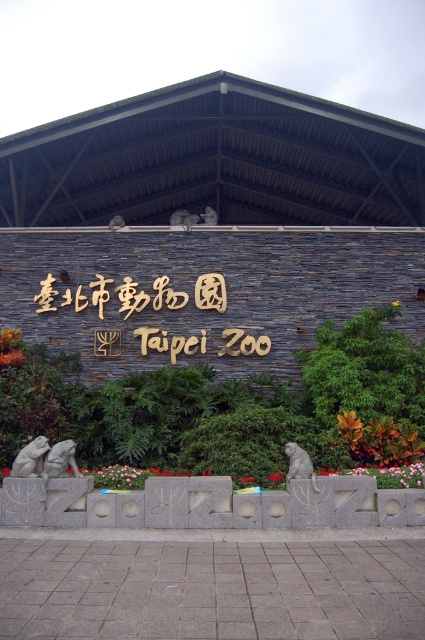
This screenshot has width=425, height=640. Identify the location of gray stone monkey at center. (300, 465).

Which is more to the left, gray stone monkey at center or stone statue at center?

stone statue at center is more to the left.

Is point (291, 461) behind point (192, 225)?

No.

This screenshot has width=425, height=640. Identify the location of gray stone monkey at center. (300, 465).

Does black wood sign at center appear over brushed metal statue at center?

Incorrect, black wood sign at center is not positioned above brushed metal statue at center.

Is point (153, 348) positioned before point (207, 214)?

Yes.

Find the location of `black wood sign at center`. black wood sign at center is located at coordinates (149, 296).

Can you confirm if gray stone elephant at lower left is smaller than stone statue at center?

Incorrect, gray stone elephant at lower left is not smaller in size than stone statue at center.

Is gray stone elephant at lower left positioned behind stone statue at center?

No, it is in front of stone statue at center.

Is point (56, 456) behind point (181, 216)?

No, (56, 456) is closer to viewer.

Locate an element on the screen. This screenshot has width=425, height=640. gray stone elephant at lower left is located at coordinates (x=59, y=460).